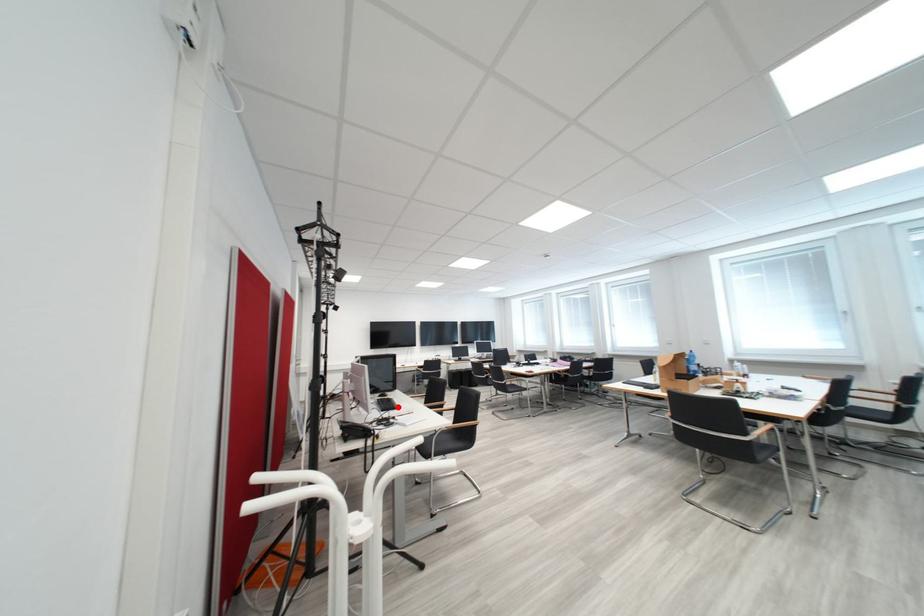
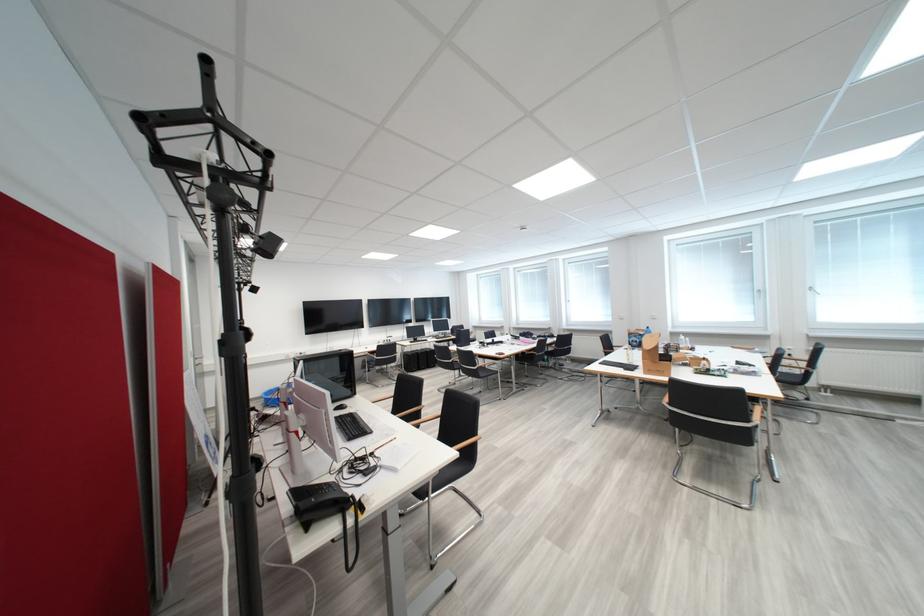
In the second image, find the point that corresponds to the highlighted location in the first image.

(365, 430)